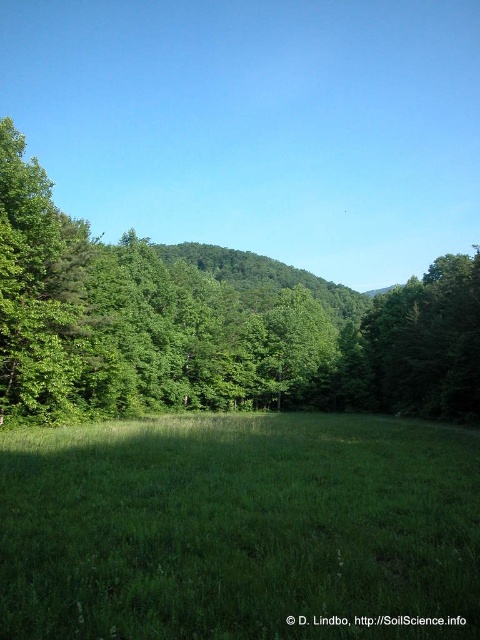
Question: Which point is closer to the camera taking this photo?

Choices:
 (A) (415, 337)
 (B) (444, 588)
 (C) (124, 301)

Answer: (B)

Question: Does green grassy field at center appear on the right side of green leafy tree at center?

Choices:
 (A) yes
 (B) no

Answer: (B)

Question: Which point appears farthest from the camera in this image?

Choices:
 (A) pyautogui.click(x=439, y=308)
 (B) pyautogui.click(x=244, y=426)

Answer: (A)

Question: Which object appears farthest from the camera in this image?

Choices:
 (A) green grassy field at center
 (B) green leafy tree at right

Answer: (B)

Question: Does green grassy field at center have a smaller size compared to green leafy tree at right?

Choices:
 (A) yes
 (B) no

Answer: (A)

Question: Does green grassy field at center appear on the left side of green leafy tree at right?

Choices:
 (A) no
 (B) yes

Answer: (B)